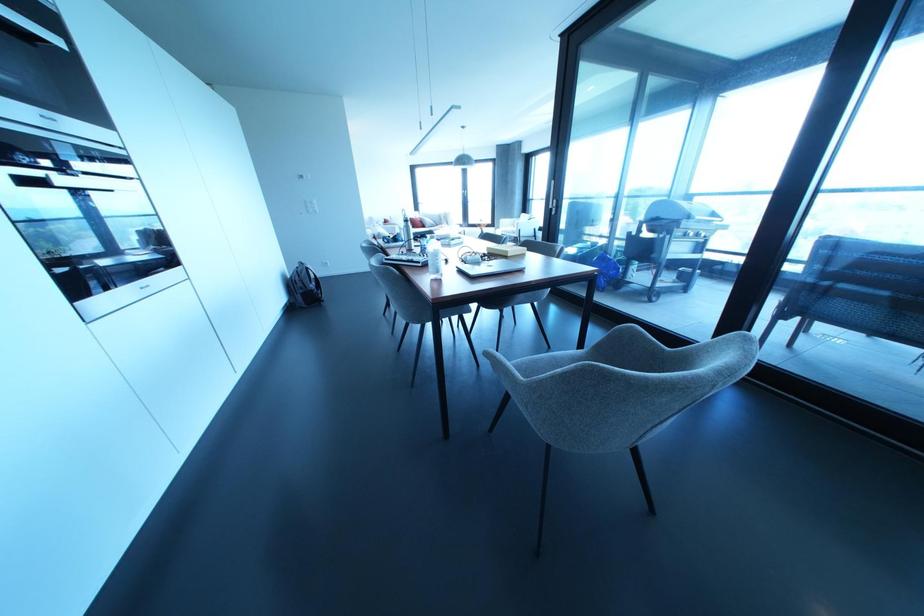
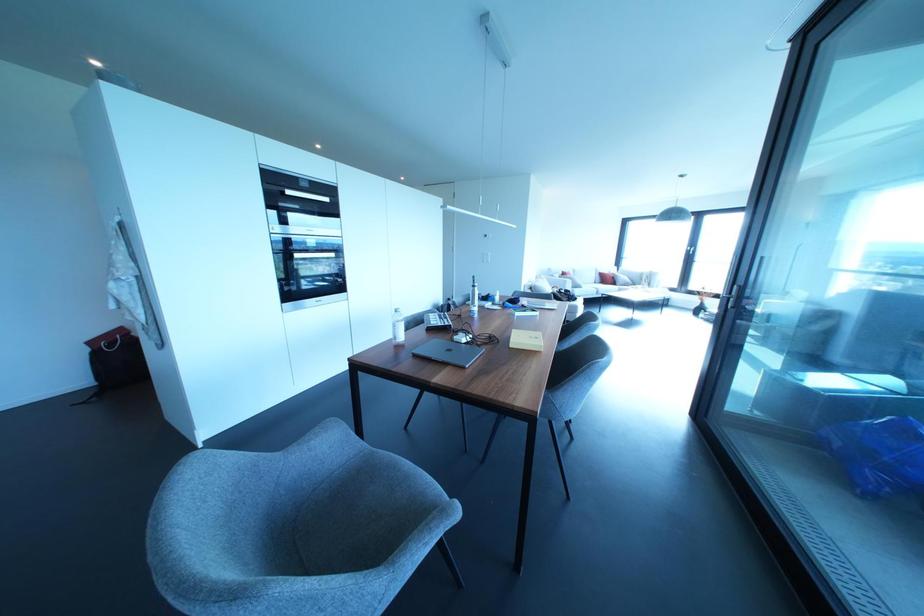
The point at [507,254] is marked in the first image. Where is the corresponding point in the second image?

(511, 345)